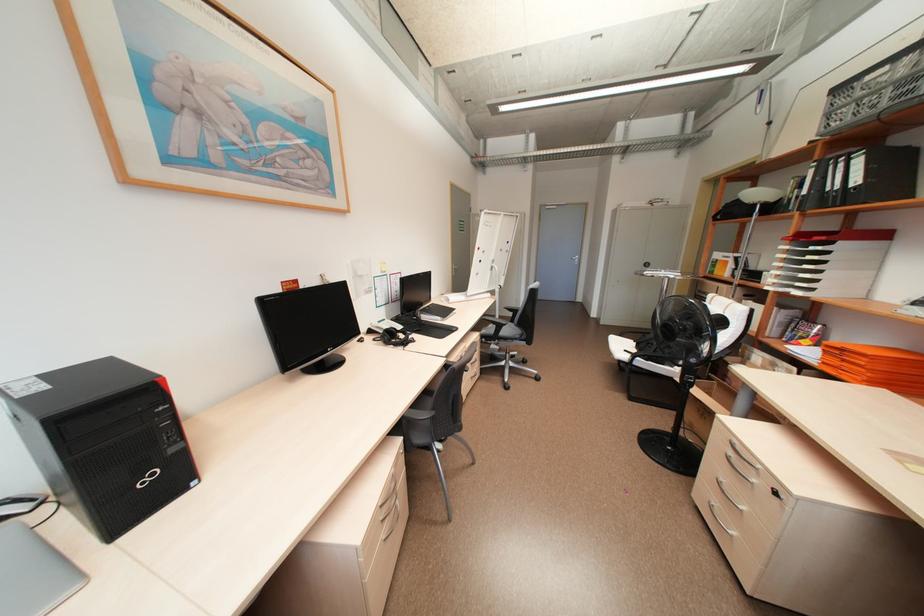
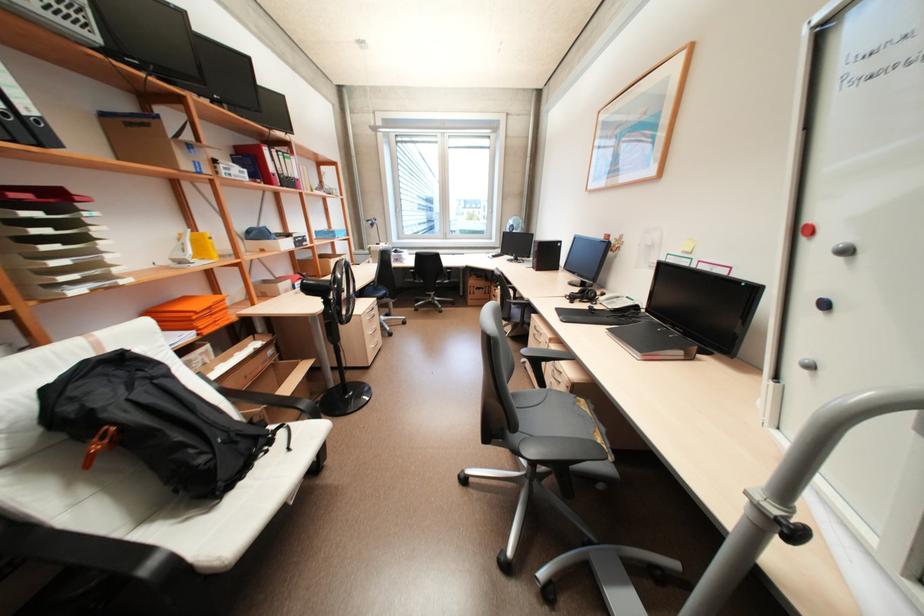
The point at [850,205] is marked in the first image. Where is the corresponding point in the second image?

(46, 146)